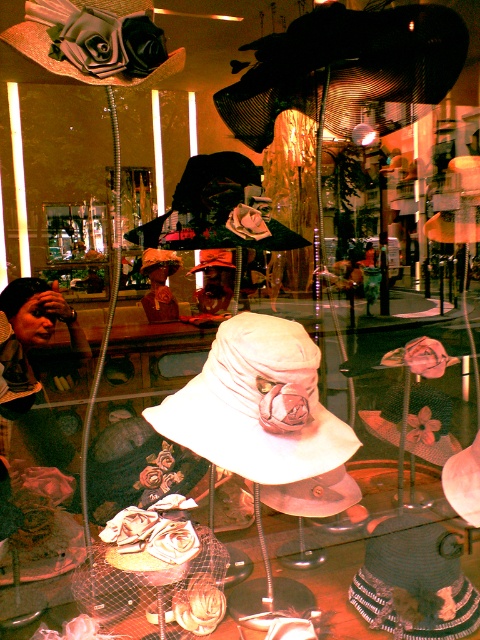
How distant is white fabric hat at center from matte black baseball hat at upper left?

They are 26.35 inches apart.

Can you confirm if white fabric hat at center is shorter than matte black baseball hat at upper left?

In fact, white fabric hat at center may be taller than matte black baseball hat at upper left.

Does point (243, 442) come closer to viewer compared to point (106, 4)?

Yes, point (243, 442) is in front of point (106, 4).

I want to click on white fabric hat at center, so click(x=257, y=404).

How much distance is there between white matte baseball hat at center and matte black baseball hat at upper left?

white matte baseball hat at center and matte black baseball hat at upper left are 16.49 inches apart from each other.

This screenshot has height=640, width=480. I want to click on white matte baseball hat at center, so click(x=220, y=209).

Which is more to the right, white fabric hat at center or white matte baseball hat at center?

white fabric hat at center is more to the right.

Is white fabric hat at center behind white matte baseball hat at center?

No, it is not.

Describe the element at coordinates (257, 404) in the screenshot. I see `white fabric hat at center` at that location.

Where is `white fabric hat at center`? This screenshot has width=480, height=640. white fabric hat at center is located at coordinates (257, 404).